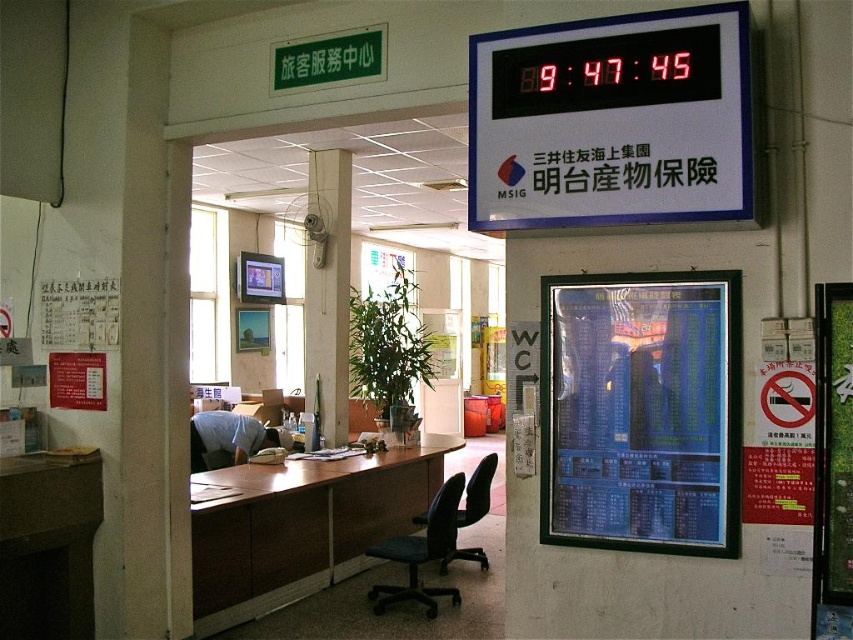
Question: Observing the image, what is the correct spatial positioning of red digital clock at upper right in reference to blue glossy poster at upper center?

Choices:
 (A) left
 (B) right

Answer: (A)

Question: Which object is positioned closest to the blue glossy poster at upper center?

Choices:
 (A) red digital clock at upper right
 (B) brown wood table at center
 (C) wooden pillar at center

Answer: (A)

Question: Does red digital clock at upper right have a larger size compared to wooden pillar at center?

Choices:
 (A) yes
 (B) no

Answer: (B)

Question: Based on their relative distances, which object is nearer to the wooden pillar at center?

Choices:
 (A) blue glossy poster at upper center
 (B) brown wood table at center

Answer: (B)

Question: Which object appears closest to the camera in this image?

Choices:
 (A) blue glossy poster at upper center
 (B) red digital clock at upper right
 (C) wooden pillar at center
 (D) brown wood table at center

Answer: (B)

Question: Is brown wood table at center positioned at the back of wooden pillar at center?

Choices:
 (A) no
 (B) yes

Answer: (A)